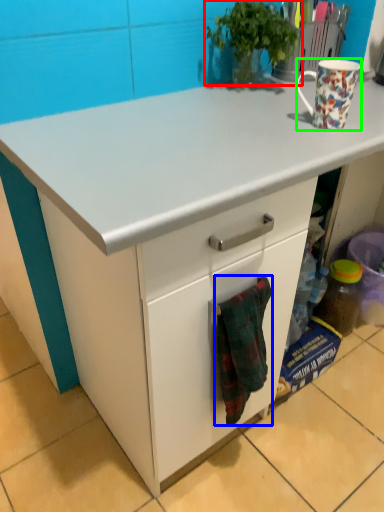
Question: Which object is positioned farthest from houseplant (highlighted by a red box)? Select from blanket (highlighted by a blue box) and coffee cup (highlighted by a green box).

Choices:
 (A) blanket
 (B) coffee cup

Answer: (A)